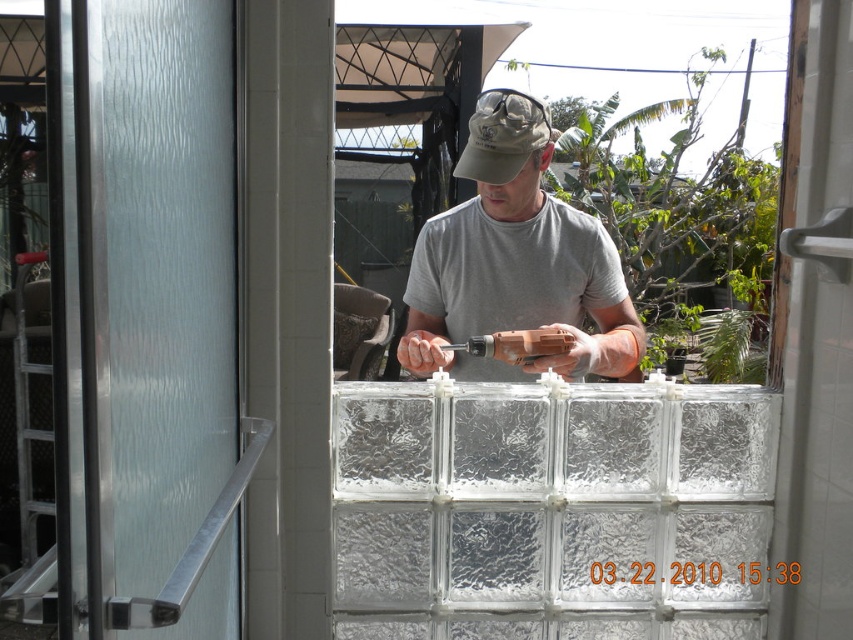
Question: Estimate the real-world distances between objects in this image. Which object is farther from the gray matte shirt at center?

Choices:
 (A) tan/cotton baseball cap at center
 (B) orange plastic drill at center

Answer: (A)

Question: Which of the following is the closest to the observer?

Choices:
 (A) gray matte shirt at center
 (B) frosted glass screen door at left
 (C) orange plastic drill at center
 (D) tan/cotton baseball cap at center

Answer: (B)

Question: Is frosted glass screen door at left to the left of tan/cotton baseball cap at center from the viewer's perspective?

Choices:
 (A) yes
 (B) no

Answer: (A)

Question: Can you confirm if frosted glass screen door at left is positioned to the left of orange plastic drill at center?

Choices:
 (A) no
 (B) yes

Answer: (B)

Question: Which of the following is the closest to the observer?

Choices:
 (A) frosted glass screen door at left
 (B) gray matte shirt at center
 (C) tan/cotton baseball cap at center

Answer: (A)

Question: Observing the image, what is the correct spatial positioning of tan/cotton baseball cap at center in reference to orange plastic drill at center?

Choices:
 (A) right
 (B) left

Answer: (A)